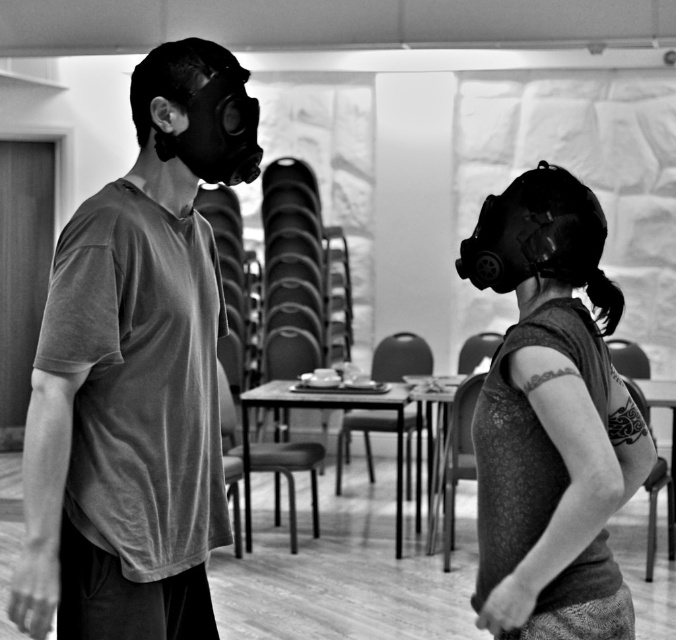
Between point (187, 129) and point (554, 186), which one is positioned in front?

Point (554, 186) is in front.

Is point (70, 356) farther from camera compared to point (550, 260)?

That is False.

This screenshot has height=640, width=676. Describe the element at coordinates (137, 374) in the screenshot. I see `matte gray t-shirt at left` at that location.

Where is `matte gray t-shirt at left`? The height and width of the screenshot is (640, 676). matte gray t-shirt at left is located at coordinates (137, 374).